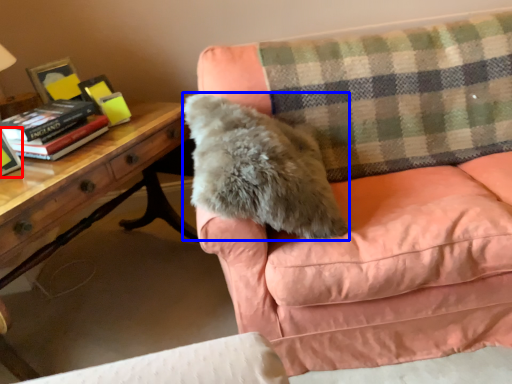
Question: Which of the following is the closest to the observer, paperback book (highlighted by a red box) or throw pillow (highlighted by a blue box)?

Choices:
 (A) paperback book
 (B) throw pillow

Answer: (B)